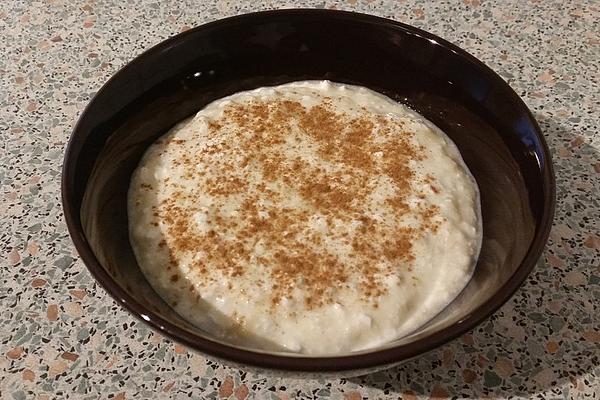
This screenshot has height=400, width=600. Identify the location of tabletop. (90, 332).